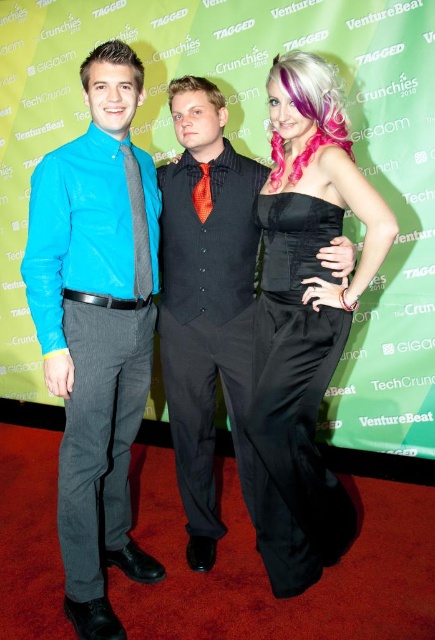
Question: Does matte blue shirt at left appear on the left side of black satin dress at center?

Choices:
 (A) yes
 (B) no

Answer: (A)

Question: Which point is closer to the camera?

Choices:
 (A) shiny black vest at center
 (B) matte blue shirt at left
 (C) black satin dress at center

Answer: (B)

Question: Can you confirm if matte blue shirt at left is thinner than black satin dress at center?

Choices:
 (A) yes
 (B) no

Answer: (B)

Question: Which point is farther to the camera?

Choices:
 (A) black satin dress at center
 (B) shiny black vest at center

Answer: (B)

Question: Is shiny black vest at center above black satin dress at center?

Choices:
 (A) no
 (B) yes

Answer: (B)

Question: Which object appears closest to the camera in this image?

Choices:
 (A) shiny black vest at center
 (B) matte blue shirt at left
 (C) black satin dress at center

Answer: (B)